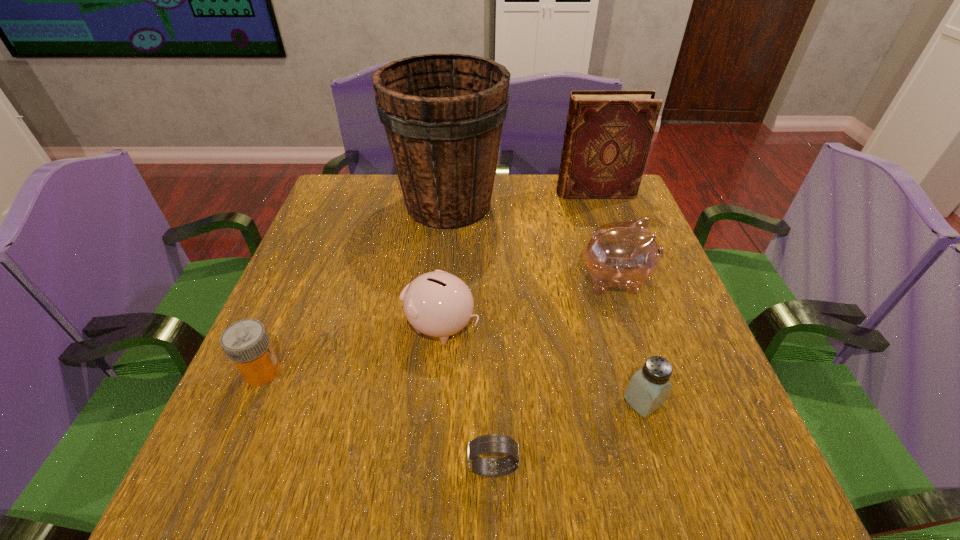
Find the location of a particular element. bucket is located at coordinates (443, 114).

The width and height of the screenshot is (960, 540). In order to click on hardback book in this screenshot , I will do `click(608, 135)`.

The image size is (960, 540). I want to click on the third farthest object, so click(625, 254).

Where is `the taller piggy bank`? Image resolution: width=960 pixels, height=540 pixels. the taller piggy bank is located at coordinates (625, 254).

Where is `the nearer piggy bank`? The image size is (960, 540). the nearer piggy bank is located at coordinates click(x=438, y=304).

You are a GUI agent. You are given a task and a screenshot of the screen. Output one action in this format:
    pyautogui.click(x=<x>, y=<y>)
    Task: Click on the left piggy bank
    This screenshot has width=960, height=540.
    Given the screenshot: What is the action you would take?
    pyautogui.click(x=438, y=304)

Where is `the leftmost object`? the leftmost object is located at coordinates (246, 342).

I want to click on saltshaker, so click(648, 389).

This screenshot has width=960, height=540. Find the location of `watch`. watch is located at coordinates (492, 443).

The height and width of the screenshot is (540, 960). Identify the location of the nearest object. (492, 443).